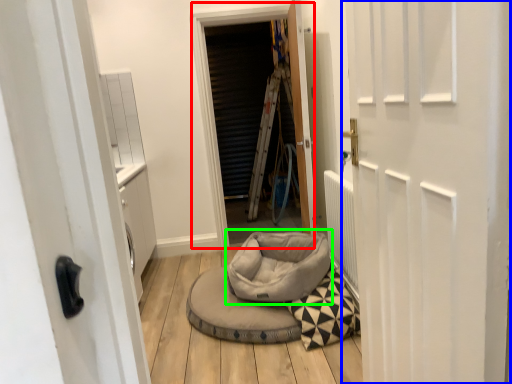
Question: Which object is positioned closest to window screen (highlighted by a red box)? Select from door (highlighted by a blue box) and bean bag chair (highlighted by a green box).

Choices:
 (A) door
 (B) bean bag chair

Answer: (B)